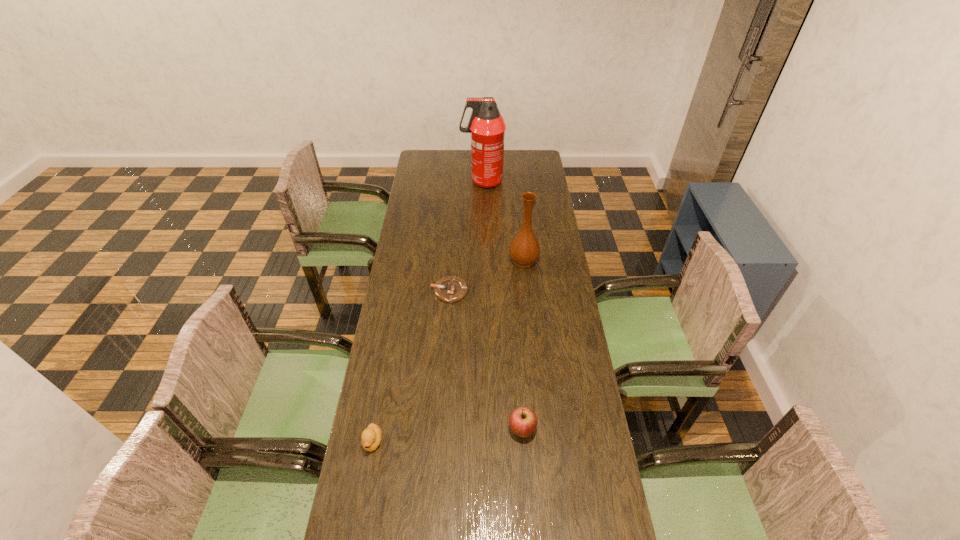
In the image, there is a desktop. Identify the location of vacant space at the left edge. (404, 374).

At what (x,y) coordinates should I click in order to perform the action: click on vacant space at the right edge of the desktop. Please return your answer as a coordinate pair (x, y). The height and width of the screenshot is (540, 960). Looking at the image, I should click on (553, 219).

In order to click on vacant space at the far right corner of the desktop in this screenshot , I will do `click(526, 171)`.

I want to click on free space between the apple and the second shortest object, so click(447, 436).

This screenshot has height=540, width=960. Find the location of `free point between the vase and the apple`. free point between the vase and the apple is located at coordinates (523, 346).

I want to click on vacant space that is in between the third nearest object and the third shortest object, so click(x=486, y=361).

In order to click on free point between the third farthest object and the second farthest object in this screenshot , I will do `click(487, 276)`.

Identify the location of vacant area between the apple and the duckling. (447, 436).

At what (x,y) coordinates should I click in order to perform the action: click on blank region between the third tallest object and the vase. Please return your answer as a coordinate pair (x, y). Looking at the image, I should click on (523, 346).

Image resolution: width=960 pixels, height=540 pixels. What are the coordinates of `object that stands as the second closest to the second tallest object` in the screenshot? It's located at (487, 127).